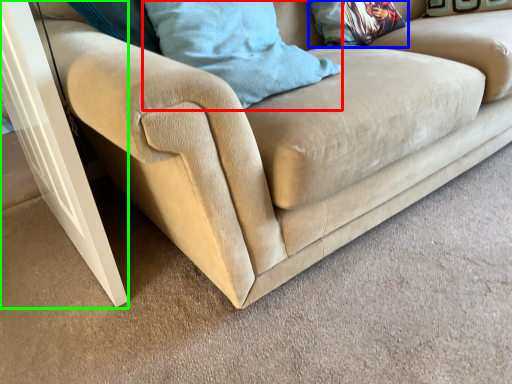
Question: Considering the real-world distances, which object is closest to pillow (highlighted by a red box)? pillow (highlighted by a blue box) or screen door (highlighted by a green box).

Choices:
 (A) pillow
 (B) screen door

Answer: (B)